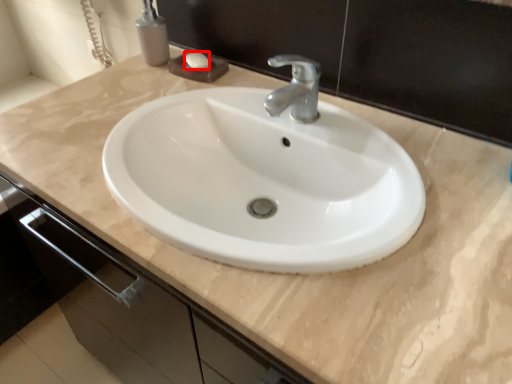
Question: From the image's perspective, considering the relative positions of soap (annotated by the red box) and soap dispenser in the image provided, where is soap (annotated by the red box) located with respect to the staircase?

Choices:
 (A) below
 (B) above

Answer: (A)